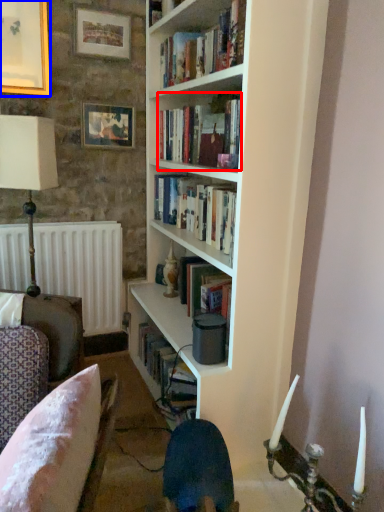
Question: Which object is further to the camera taking this photo, book (highlighted by a red box) or picture frame (highlighted by a blue box)?

Choices:
 (A) book
 (B) picture frame

Answer: (B)